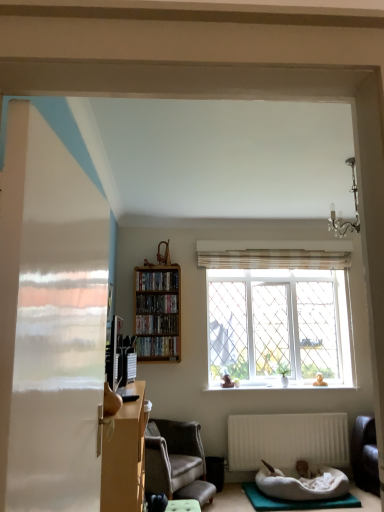
Where is `vacant region above white matte radiator at lower center (from a real-world perspective)`? The height and width of the screenshot is (512, 384). vacant region above white matte radiator at lower center (from a real-world perspective) is located at coordinates pos(295,410).